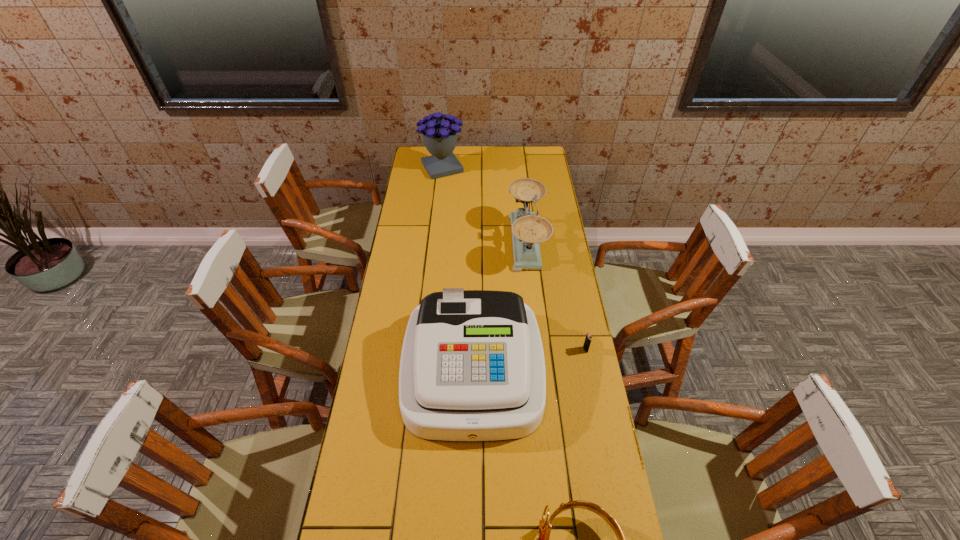
The height and width of the screenshot is (540, 960). What are the coordinates of `free space located on the left of the cash register` in the screenshot? It's located at (389, 369).

The image size is (960, 540). I want to click on free space located on the front of the shortest object, so click(x=604, y=443).

Where is `object situated at the far edge`? object situated at the far edge is located at coordinates (440, 137).

At what (x,y) coordinates should I click in order to perform the action: click on bouquet that is at the left edge. Please return your answer as a coordinate pair (x, y). The height and width of the screenshot is (540, 960). Looking at the image, I should click on (440, 137).

Locate an element on the screen. cash register at the left edge is located at coordinates (472, 369).

Where is `scale at the right edge`? This screenshot has height=540, width=960. scale at the right edge is located at coordinates tap(528, 230).

Identify the location of igniter present at the right edge. (587, 342).

Locate an element on the screen. Image resolution: width=960 pixels, height=540 pixels. object positioned at the far left corner is located at coordinates (440, 137).

In the image, there is a desktop. Identify the location of free space at the left edge. (x=409, y=220).

In the image, there is a desktop. What are the coordinates of `vacant area at the right edge` in the screenshot? It's located at (563, 293).